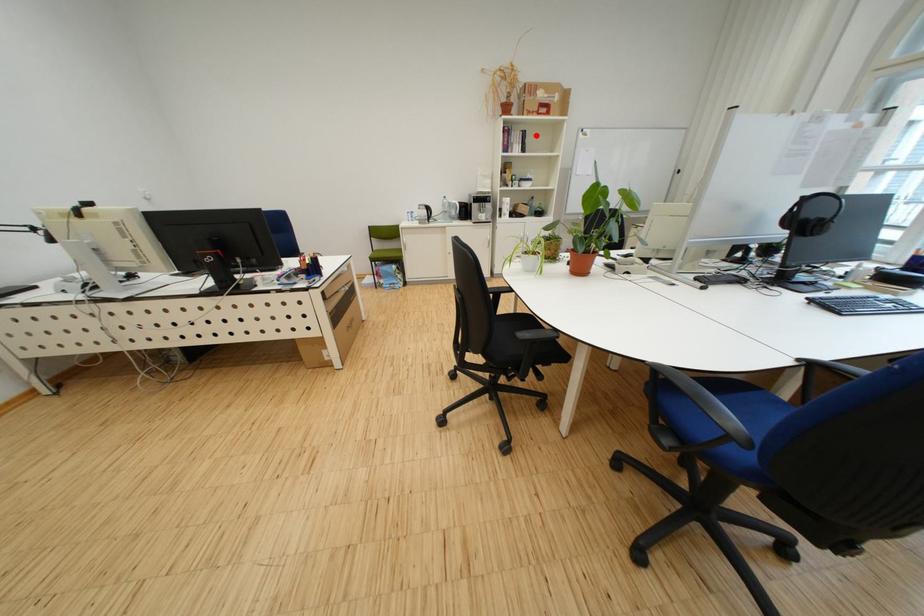
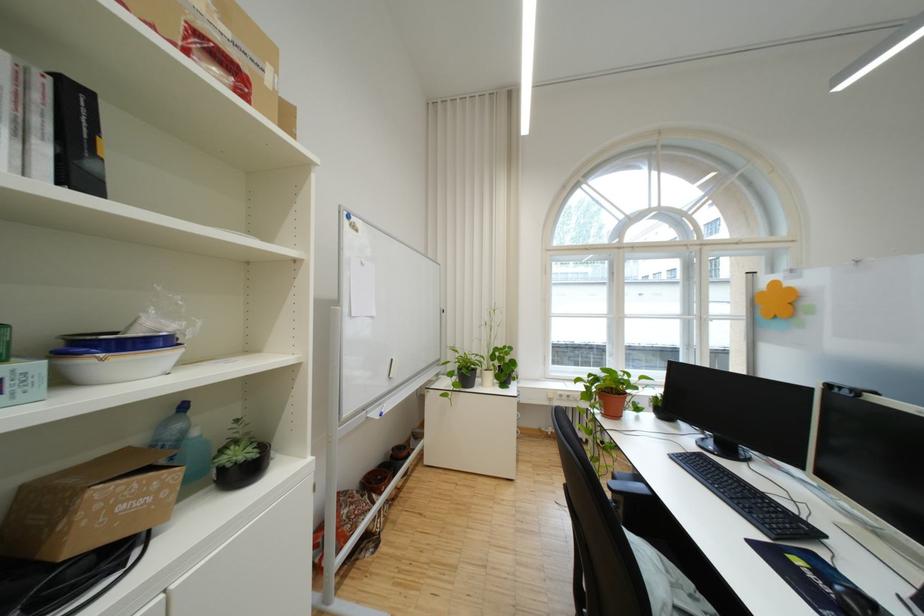
Question: I am providing you with two images of the same scene from different viewpoints. In image1, a red point is highlighted. Considering the same 3D point in image2, which of the following is correct?

Choices:
 (A) It is closer
 (B) It is farther

Answer: (B)